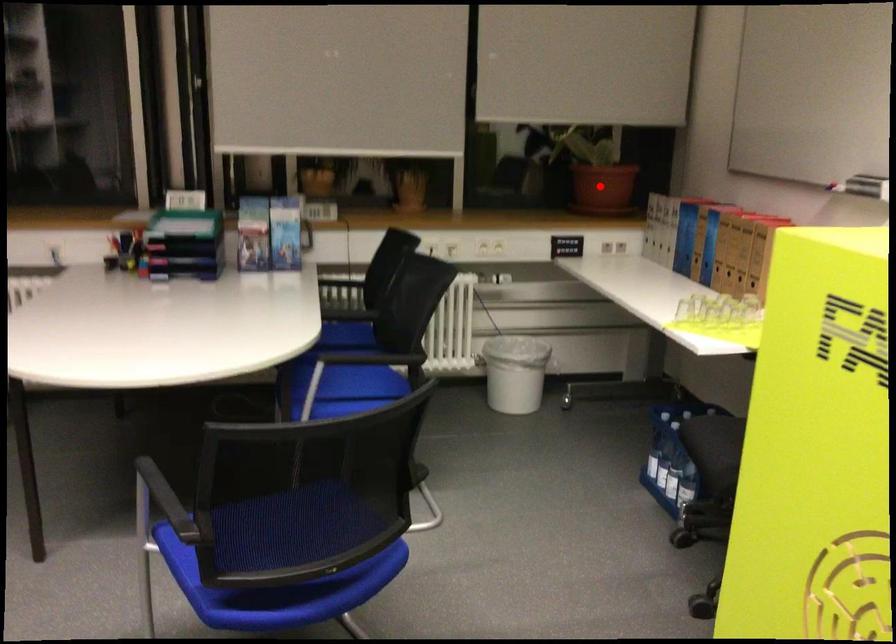
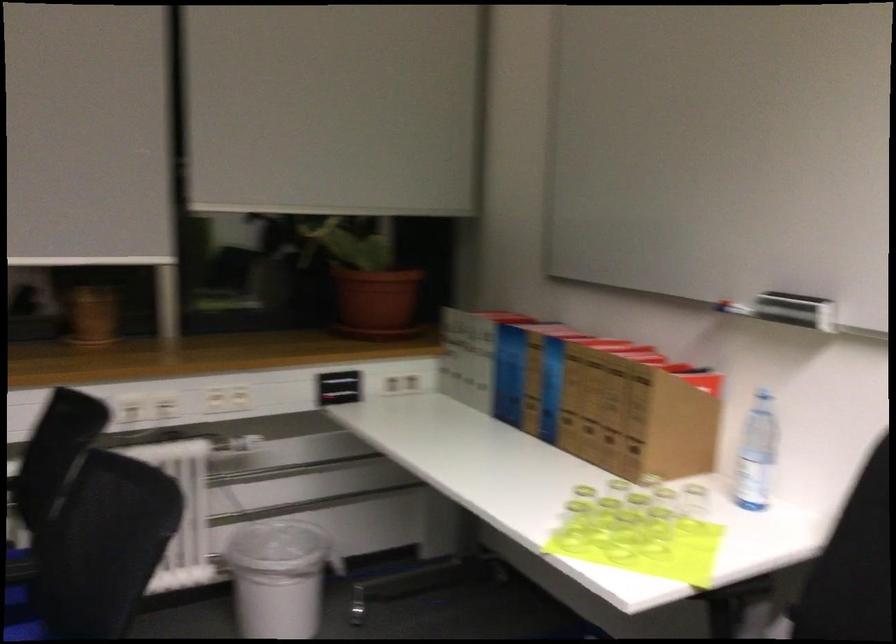
Question: I am providing you with two images of the same scene from different viewpoints. Image1 has a red point marked. In image2, the corresponding 3D location appears at what relative position? Reply with the corresponding letter.

Choices:
 (A) Closer
 (B) Farther

Answer: (A)